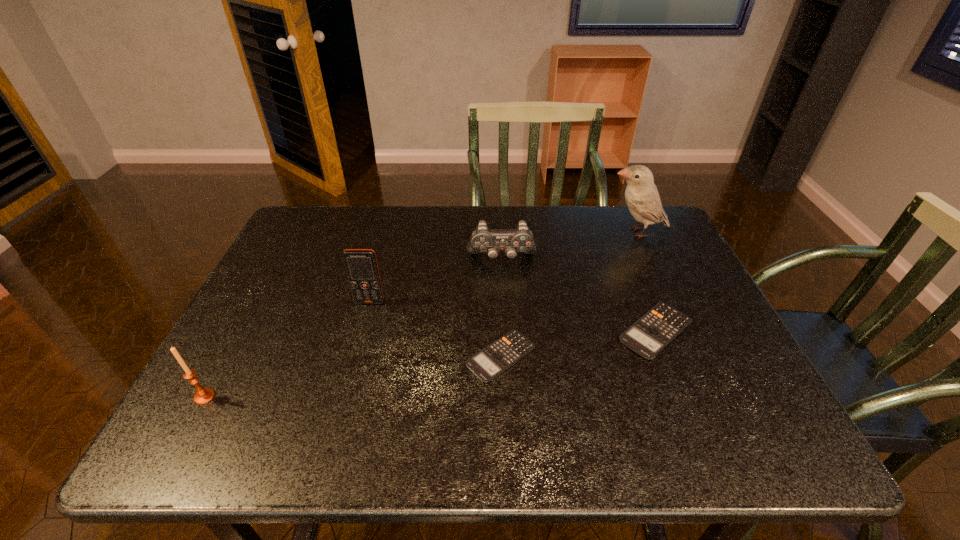
Locate an element on the screen. The image size is (960, 540). the left calculator is located at coordinates (494, 359).

The image size is (960, 540). Identify the location of the shorter calculator. (494, 359).

The width and height of the screenshot is (960, 540). In order to click on the right calculator in this screenshot , I will do `click(648, 336)`.

This screenshot has width=960, height=540. What are the coordinates of `the taller calculator` in the screenshot? It's located at (648, 336).

The width and height of the screenshot is (960, 540). What are the coordinates of `the tallest object` in the screenshot? It's located at (641, 195).

Locate an element on the screen. The width and height of the screenshot is (960, 540). the farthest object is located at coordinates (641, 195).

Where is `the fifth object from right to left`? The image size is (960, 540). the fifth object from right to left is located at coordinates (361, 266).

I want to click on control, so click(483, 239).

At what (x,y) coordinates should I click in order to perform the action: click on the third shortest object. Please return your answer as a coordinate pair (x, y). Looking at the image, I should click on (483, 239).

This screenshot has width=960, height=540. Identify the location of candle_holder. coord(203,395).